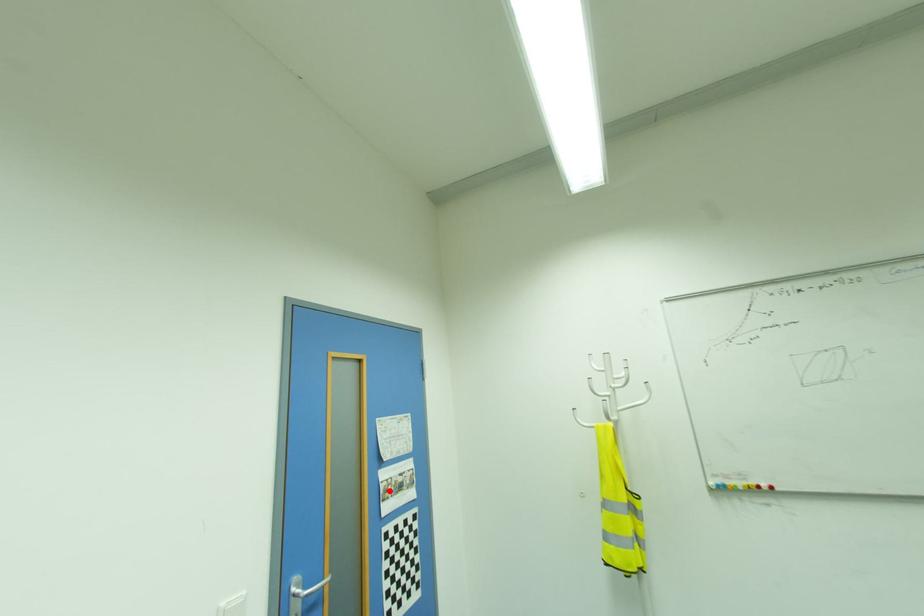
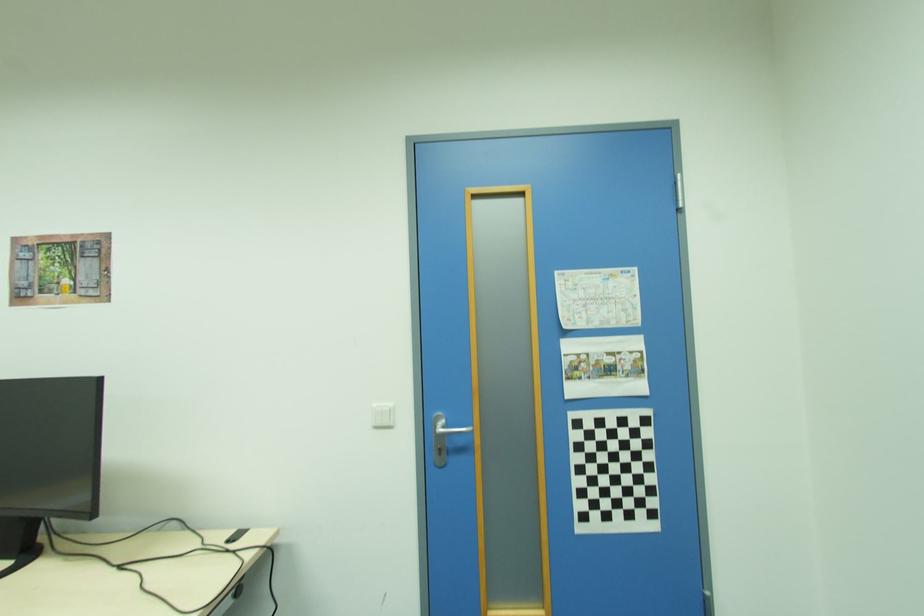
Find the pixel in the second image that matches the highlighted location in the first image.

(579, 369)